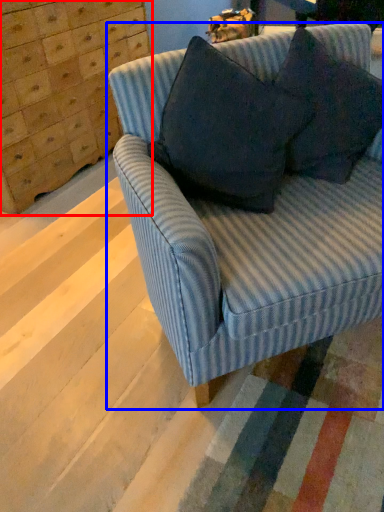
Question: Which object appears farthest to the camera in this image, dresser (highlighted by a red box) or studio couch (highlighted by a blue box)?

Choices:
 (A) dresser
 (B) studio couch

Answer: (A)